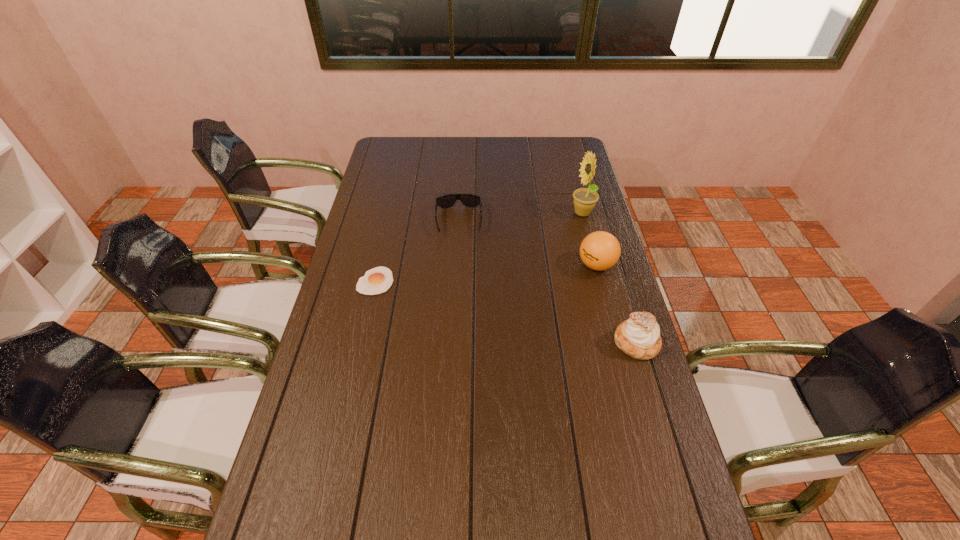
Image resolution: width=960 pixels, height=540 pixels. Find the location of `the shortest object`. the shortest object is located at coordinates (378, 280).

Locate an element on the screen. The width and height of the screenshot is (960, 540). egg yolk is located at coordinates (378, 280).

Locate an element on the screen. The image size is (960, 540). the nearest object is located at coordinates (639, 337).

Find the location of a particular element. ping-pong ball is located at coordinates (600, 250).

The width and height of the screenshot is (960, 540). In order to click on sunglasses in this screenshot , I will do `click(469, 200)`.

Where is `the fourth tallest object`? This screenshot has width=960, height=540. the fourth tallest object is located at coordinates (469, 200).

Find the location of `the tallest object`. the tallest object is located at coordinates (585, 199).

Locate an element on the screen. This screenshot has width=960, height=540. vacant space positioned on the front of the leftmost object is located at coordinates (370, 308).

Find the location of a particular element. vacant space situated on the left of the pastry is located at coordinates (477, 342).

This screenshot has width=960, height=540. I want to click on vacant space situated on the side with brand of the ping-pong ball, so click(x=535, y=285).